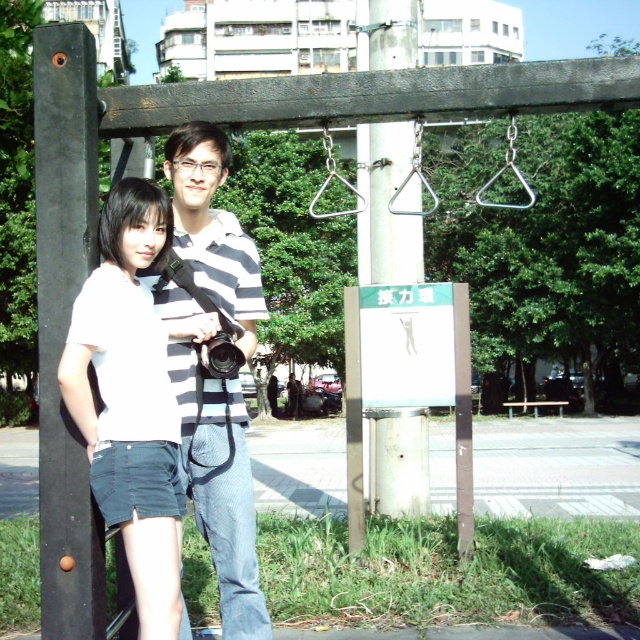
You are standing at the playground and want to take a photo of both the point at coordinates (88,67) and the point at coordinates (216,374). Which point should you focus on first to ensure both are in the frame?

You should focus on point (88,67) first because it is in front of point (216,374), so it will be closer to the camera and easier to include both in the frame.

You are standing at point (65,324) in the playground. What object is located exactly at this point?

The black matte pole at left is located exactly at point (65,324).

You are a photographer trying to capture both the striped cotton shirt at center and the black plastic camera at center in a single frame. Which object should you focus on first to ensure both are in the frame?

The striped cotton shirt at center is taller than the black plastic camera at center, so you should focus on the striped cotton shirt at center first to ensure both are in the frame.